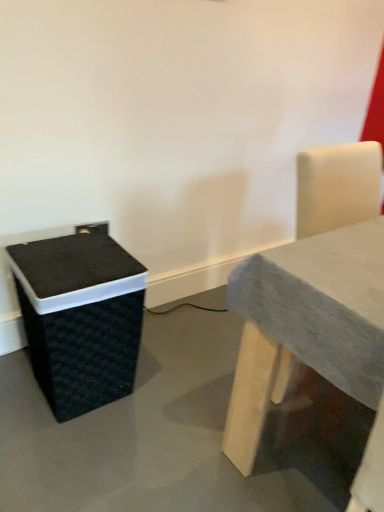
Describe the element at coordinates (80, 318) in the screenshot. This screenshot has height=512, width=384. I see `black woven basket at lower left` at that location.

Locate an element on the screen. The height and width of the screenshot is (512, 384). black woven basket at lower left is located at coordinates (80, 318).

Describe the element at coordinates (306, 325) in the screenshot. I see `gray fabric table at right` at that location.

The width and height of the screenshot is (384, 512). I want to click on gray fabric table at right, so click(306, 325).

At what (x,y) coordinates should I click in order to perform the action: click on black woven basket at lower left. Please return your answer as a coordinate pair (x, y). The image size is (384, 512). Looking at the image, I should click on (80, 318).

Would you say black woven basket at lower left is to the left or to the right of gray fabric table at right in the picture?

Clearly, black woven basket at lower left is on the left of gray fabric table at right in the image.

Is black woven basket at lower left closer to the viewer compared to gray fabric table at right?

No, black woven basket at lower left is behind gray fabric table at right.

Between point (101, 400) and point (368, 364), which one is positioned in front?

Positioned in front is point (368, 364).

From the image's perspective, between black woven basket at lower left and gray fabric table at right, who is located below?

black woven basket at lower left is shown below in the image.

From a real-world perspective, is black woven basket at lower left positioned above or below gray fabric table at right?

From a real-world perspective, black woven basket at lower left is physically below gray fabric table at right.

Considering the relative sizes of black woven basket at lower left and gray fabric table at right in the image provided, is black woven basket at lower left thinner than gray fabric table at right?

Yes, black woven basket at lower left is thinner than gray fabric table at right.

Considering the sizes of objects black woven basket at lower left and gray fabric table at right in the image provided, who is taller, black woven basket at lower left or gray fabric table at right?

gray fabric table at right.

In the scene shown: Considering the sizes of objects black woven basket at lower left and gray fabric table at right in the image provided, who is smaller, black woven basket at lower left or gray fabric table at right?

black woven basket at lower left is smaller.

Would you say black woven basket at lower left is inside or outside gray fabric table at right?

black woven basket at lower left lies outside gray fabric table at right.

Is black woven basket at lower left touching gray fabric table at right?

No, black woven basket at lower left is not in contact with gray fabric table at right.

Is black woven basket at lower left aimed at gray fabric table at right?

No, black woven basket at lower left is not facing towards gray fabric table at right.

How far apart are black woven basket at lower left and gray fabric table at right?

A distance of 21.21 inches exists between black woven basket at lower left and gray fabric table at right.

There is a black woven basket at lower left. At what (x,y) coordinates should I click in order to perform the action: click on table above it (from a real-world perspective). Please return your answer as a coordinate pair (x, y). This screenshot has width=384, height=512. Looking at the image, I should click on point(306,325).

Between gray fabric table at right and black woven basket at lower left, which one appears on the left side from the viewer's perspective?

From the viewer's perspective, black woven basket at lower left appears more on the left side.

Which object is further away from the camera, gray fabric table at right or black woven basket at lower left?

Positioned behind is black woven basket at lower left.

Between point (225, 432) and point (67, 260), which one is positioned in front?

The point (67, 260) is closer to the camera.

From the image's perspective, which is above, gray fabric table at right or black woven basket at lower left?

From the image's view, gray fabric table at right is above.

From the picture: From a real-world perspective, between gray fabric table at right and black woven basket at lower left, who is vertically higher?

gray fabric table at right is physically above.

From the picture: Is gray fabric table at right wider or thinner than black woven basket at lower left?

Clearly, gray fabric table at right has more width compared to black woven basket at lower left.

Is gray fabric table at right shorter than black woven basket at lower left?

No.

Looking at this image, can you confirm if gray fabric table at right is smaller than black woven basket at lower left?

No, gray fabric table at right is not smaller than black woven basket at lower left.

Could black woven basket at lower left be considered to be inside gray fabric table at right?

No, gray fabric table at right does not contain black woven basket at lower left.

Can you see gray fabric table at right touching black woven basket at lower left?

gray fabric table at right is not next to black woven basket at lower left, and they're not touching.

Is gray fabric table at right facing towards black woven basket at lower left?

No.

Measure the distance from gray fabric table at right to black woven basket at lower left.

gray fabric table at right and black woven basket at lower left are 21.21 inches apart.

The image size is (384, 512). Find the location of `recycling bin below the gray fabric table at right (from the image's perspective)`. recycling bin below the gray fabric table at right (from the image's perspective) is located at coordinates (80, 318).

This screenshot has height=512, width=384. In order to click on recycling bin lying below the gray fabric table at right (from the image's perspective) in this screenshot , I will do `click(80, 318)`.

The image size is (384, 512). Identify the location of table located in front of the black woven basket at lower left. (306, 325).